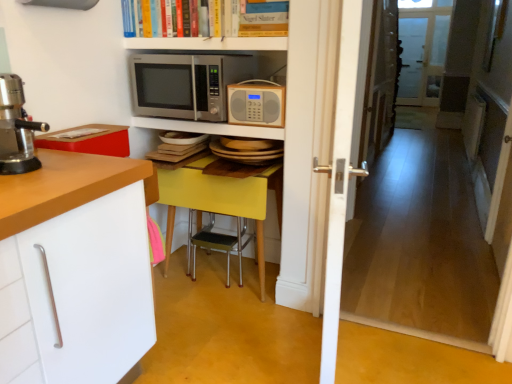
Where is `blank space to the left of white wooden door at center`? This screenshot has height=384, width=512. blank space to the left of white wooden door at center is located at coordinates (241, 354).